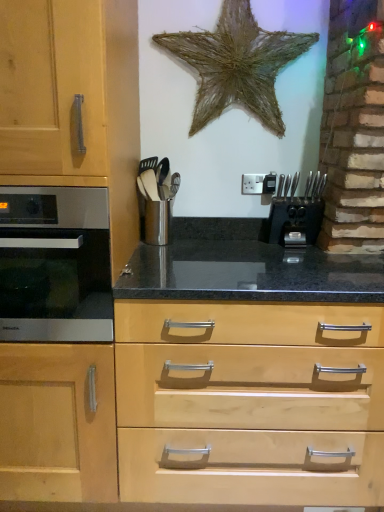
Question: From a real-world perspective, is satin silver oven at left below black plastic knife block at center right?

Choices:
 (A) no
 (B) yes

Answer: (B)

Question: From a real-world perspective, is satin silver oven at left on top of black plastic knife block at center right?

Choices:
 (A) no
 (B) yes

Answer: (A)

Question: Considering the relative sizes of satin silver oven at left and black plastic knife block at center right in the image provided, is satin silver oven at left smaller than black plastic knife block at center right?

Choices:
 (A) no
 (B) yes

Answer: (A)

Question: From the image's perspective, is satin silver oven at left on black plastic knife block at center right?

Choices:
 (A) no
 (B) yes

Answer: (A)

Question: Is the depth of satin silver oven at left greater than that of black plastic knife block at center right?

Choices:
 (A) no
 (B) yes

Answer: (A)

Question: Does satin silver oven at left have a lesser width compared to black plastic knife block at center right?

Choices:
 (A) no
 (B) yes

Answer: (A)

Question: Does black plastic knife block at center right have a lesser width compared to metallic silver utensil holder at center?

Choices:
 (A) yes
 (B) no

Answer: (B)

Question: Can you confirm if black plastic knife block at center right is bigger than metallic silver utensil holder at center?

Choices:
 (A) yes
 (B) no

Answer: (A)

Question: Is black plastic knife block at center right positioned in front of metallic silver utensil holder at center?

Choices:
 (A) no
 (B) yes

Answer: (A)

Question: Is black plastic knife block at center right not inside metallic silver utensil holder at center?

Choices:
 (A) yes
 (B) no

Answer: (A)

Question: Is black plastic knife block at center right at the left side of metallic silver utensil holder at center?

Choices:
 (A) yes
 (B) no

Answer: (B)

Question: Are black plastic knife block at center right and metallic silver utensil holder at center located far from each other?

Choices:
 (A) no
 (B) yes

Answer: (A)

Question: Is metallic silver utensil holder at center wider than satin silver oven at left?

Choices:
 (A) yes
 (B) no

Answer: (B)